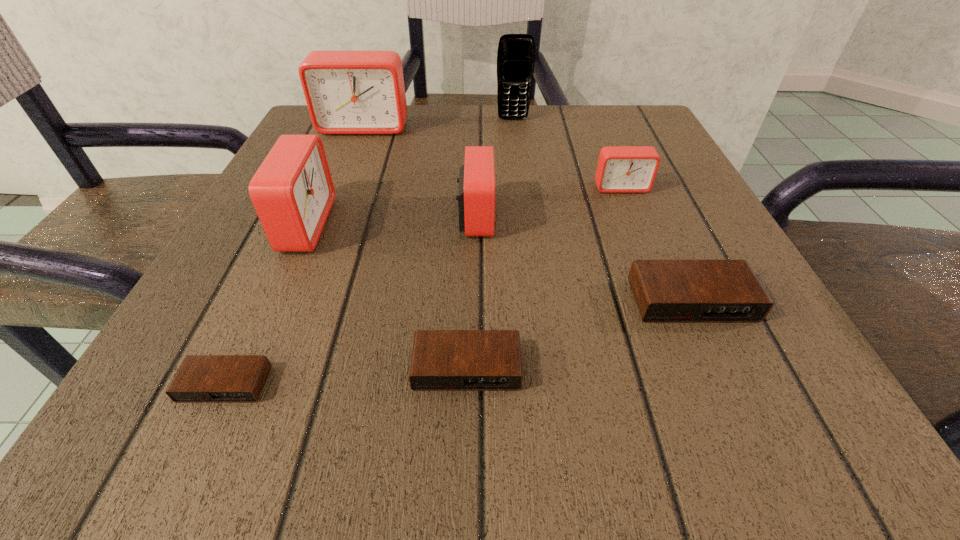
In order to click on vacant space situated on the front face of the third shortest object in this screenshot , I will do `click(717, 356)`.

This screenshot has height=540, width=960. I want to click on cellular telephone located at the far edge, so click(x=516, y=52).

Identify the location of alarm clock situated at the far edge. This screenshot has width=960, height=540. (347, 92).

This screenshot has height=540, width=960. In order to click on object present at the far left corner in this screenshot , I will do `click(347, 92)`.

Find the location of `object positioned at the near left corner`. object positioned at the near left corner is located at coordinates (200, 378).

In the image, there is a desktop. Where is `vacant space at the far edge`? Image resolution: width=960 pixels, height=540 pixels. vacant space at the far edge is located at coordinates (545, 115).

Where is `vacant space at the near edge`? Image resolution: width=960 pixels, height=540 pixels. vacant space at the near edge is located at coordinates (512, 430).

You are a GUI agent. You are given a task and a screenshot of the screen. Output one action in this format:
    pyautogui.click(x=<x>, y=<y>)
    Task: Click on the free space at the left edge of the desktop
    Image resolution: width=960 pixels, height=540 pixels.
    Given the screenshot: What is the action you would take?
    pyautogui.click(x=319, y=307)

In the image, there is a desktop. Where is `vacant space at the right edge`? This screenshot has height=540, width=960. vacant space at the right edge is located at coordinates (688, 174).

In the image, there is a desktop. Where is `free region at the near left corner`? free region at the near left corner is located at coordinates (214, 433).